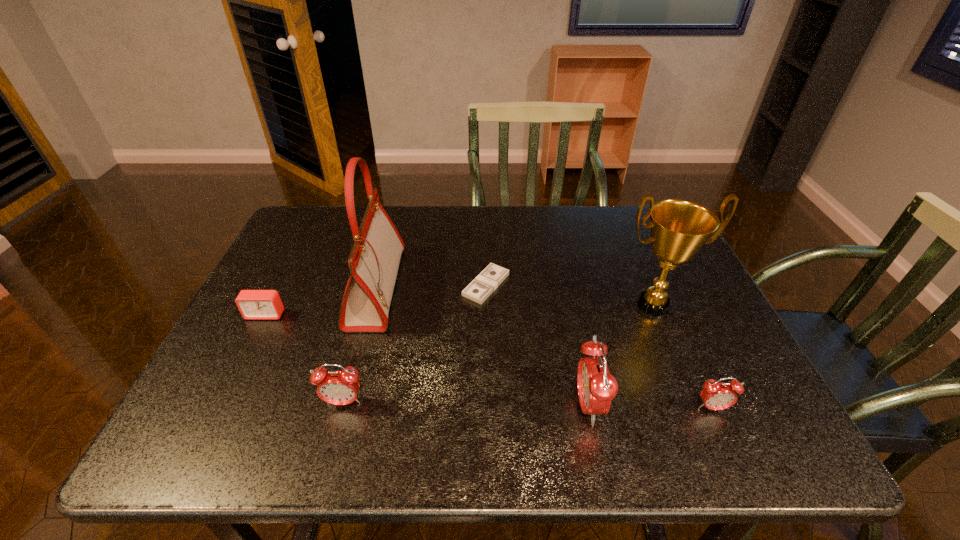
The height and width of the screenshot is (540, 960). In order to click on free space between the rightmost alarm clock and the third object from right to left in this screenshot , I will do pyautogui.click(x=650, y=407).

Locate an element on the screen. free space that is in between the fourth shortest object and the shortest object is located at coordinates (415, 344).

What are the coordinates of `vacant region between the rightmost alarm clock and the handbag` in the screenshot? It's located at (544, 348).

What are the coordinates of `unoccupied area between the third alarm clock from right to left and the award` in the screenshot? It's located at click(x=498, y=354).

Image resolution: width=960 pixels, height=540 pixels. Identify the location of vacant space in between the fourth tallest object and the award. (498, 354).

This screenshot has width=960, height=540. Identify the location of vacant area that lies between the third shortest alarm clock and the award. (498, 354).

Image resolution: width=960 pixels, height=540 pixels. I want to click on free space between the shortest alarm clock and the handbag, so pyautogui.click(x=321, y=301).

Where is `free space between the dollar and the handbag`? This screenshot has height=540, width=960. free space between the dollar and the handbag is located at coordinates (431, 286).

I want to click on object that is the third nearest to the handbag, so click(x=336, y=387).

Where is `object that stands as the fifth closest to the second alarm clock from left to right`? object that stands as the fifth closest to the second alarm clock from left to right is located at coordinates (679, 228).